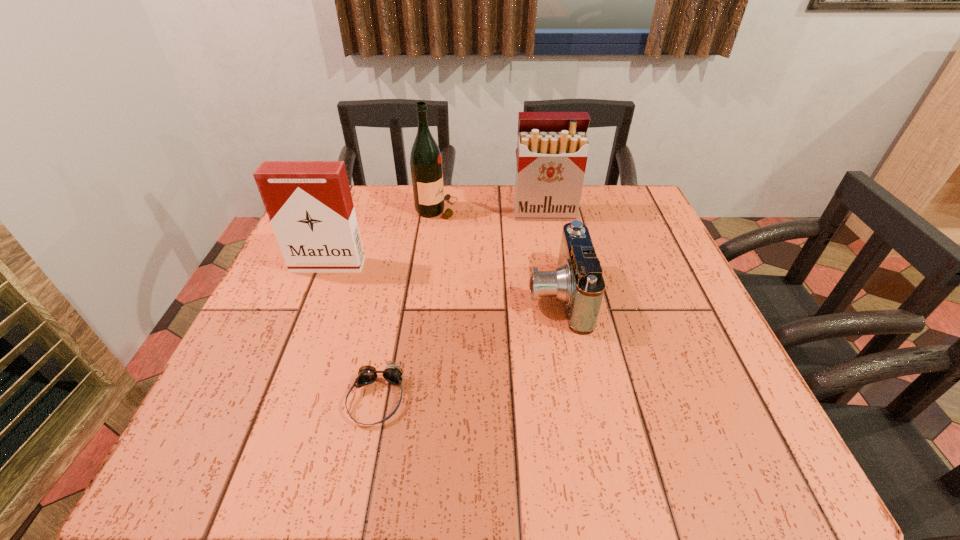
The width and height of the screenshot is (960, 540). I want to click on free spot between the wine bottle and the goggles, so click(x=407, y=304).

At what (x,y) coordinates should I click in order to perform the action: click on vacant region between the right cigarette_case and the goggles. Please return your answer as a coordinate pair (x, y). Looking at the image, I should click on (461, 306).

Identify the location of vacant point located between the second shortest object and the wine bottle. Image resolution: width=960 pixels, height=540 pixels. (497, 253).

Select which object appears as the second closest to the shortest object. Please provide its 2D coordinates. Your answer should be formatted as a tuple, i.e. [(x, y)], where the tuple contains the x and y coordinates of a point satisfying the conditions above.

[(309, 203)]

Point out which object is positioned as the third nearest to the fourth tallest object. Please provide its 2D coordinates. Your answer should be formatted as a tuple, i.e. [(x, y)], where the tuple contains the x and y coordinates of a point satisfying the conditions above.

[(367, 374)]